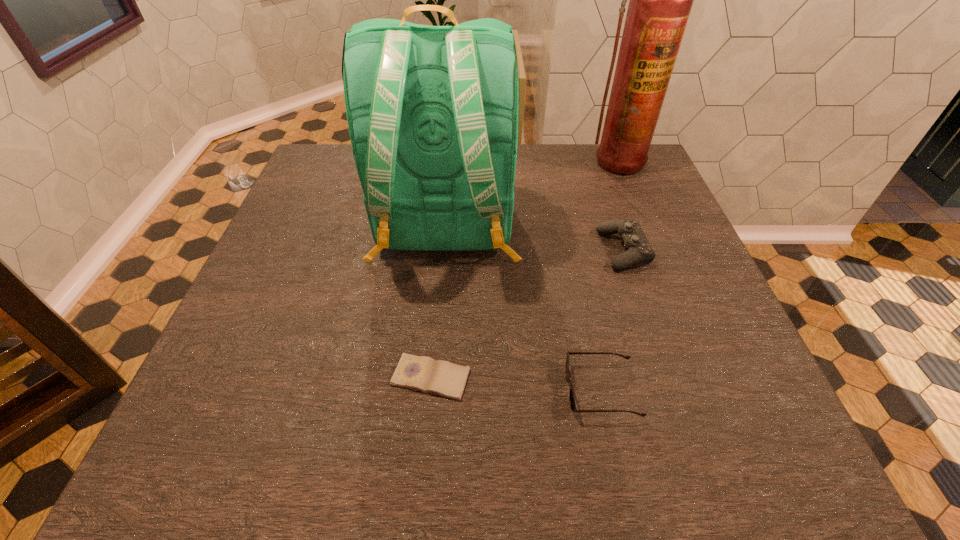
In order to click on vacant space located on the front lenses of the second shortest object in this screenshot , I will do [418, 391].

The image size is (960, 540). I want to click on free point located 0.210m on the front lenses of the second shortest object, so click(451, 391).

Find the location of a particular element. vacant space located 0.270m on the left of the diary is located at coordinates (245, 377).

Where is `fire extinguisher located at the far edge`? The width and height of the screenshot is (960, 540). fire extinguisher located at the far edge is located at coordinates (660, 0).

Where is `backpack located at the far edge`? backpack located at the far edge is located at coordinates (433, 111).

Identify the location of fire extinguisher that is positioned at the right edge. (660, 0).

Where is `control located in the right edge section of the desktop`? The height and width of the screenshot is (540, 960). control located in the right edge section of the desktop is located at coordinates (638, 247).

The width and height of the screenshot is (960, 540). In order to click on object that is at the far right corner in this screenshot , I will do `click(660, 0)`.

Identify the location of vacant region at the far edge of the desktop. (518, 155).

The height and width of the screenshot is (540, 960). In the image, there is a desktop. What are the coordinates of `vacant space at the near edge` in the screenshot? It's located at (362, 447).